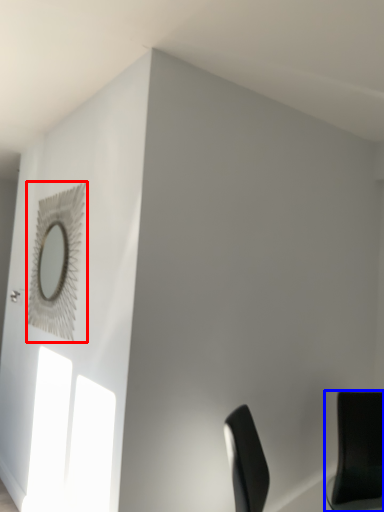
Question: Which object is further to the camera taking this photo, mirror (highlighted by a red box) or chair (highlighted by a blue box)?

Choices:
 (A) mirror
 (B) chair

Answer: (A)